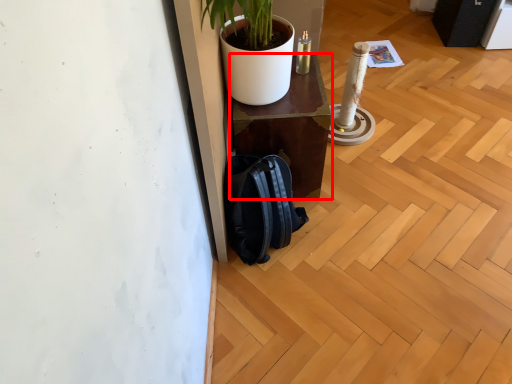
Question: From the image's perspective, what is the correct spatial relationship of furniture (annotated by the red box) in relation to backpack?

Choices:
 (A) above
 (B) below

Answer: (A)